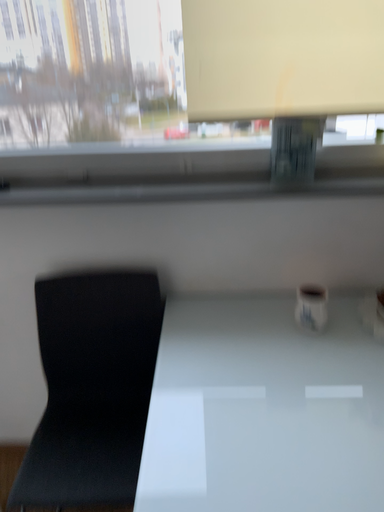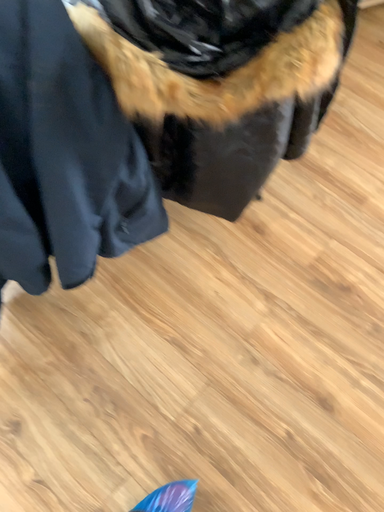
Question: How did the camera likely rotate when shooting the video?

Choices:
 (A) rotated left
 (B) rotated right

Answer: (B)